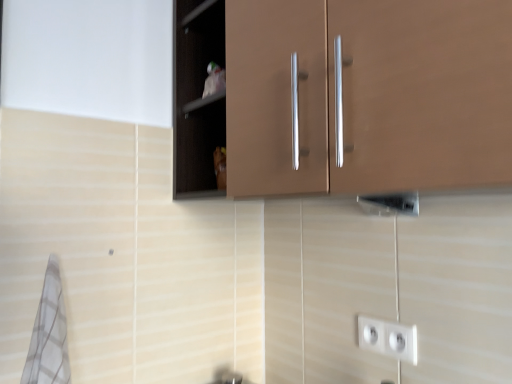
The width and height of the screenshot is (512, 384). I want to click on white plastic socket at lower right, so click(x=388, y=338).

Measure the distance between point (56, 302) and camera.

A distance of 93.80 centimeters exists between point (56, 302) and camera.

What do you see at coordinates (343, 95) in the screenshot? The height and width of the screenshot is (384, 512). I see `matte brown cabinet at upper center, arranged as the second cabinetry when viewed from the back` at bounding box center [343, 95].

Locate an element on the screen. The image size is (512, 384). white plastic socket at lower right is located at coordinates (388, 338).

Is matte brown cabinet at upper center, arranged as the second cabinetry when viewed from the back, positioned in front of white plastic socket at lower right?

Yes, matte brown cabinet at upper center, arranged as the second cabinetry when viewed from the back, is in front of white plastic socket at lower right.

In order to click on socket lying behind the matte brown cabinet at upper center, arranged as the second cabinetry when viewed from the back in this screenshot , I will do `click(388, 338)`.

From a real-world perspective, who is located lower, matte brown cabinet at upper center, the 1th cabinetry viewed from the front, or white plastic socket at lower right?

In real-world perspective, white plastic socket at lower right is lower.

From the image's perspective, does white checkered bath towel at lower left appear higher than matte brown cabinet at upper center, the 1th cabinetry viewed from the front?

No.

Is white checkered bath towel at lower left aimed at matte brown cabinet at upper center, arranged as the second cabinetry when viewed from the back?

No, white checkered bath towel at lower left does not turn towards matte brown cabinet at upper center, arranged as the second cabinetry when viewed from the back.

Can you confirm if white checkered bath towel at lower left is wider than matte brown cabinet at upper center, arranged as the second cabinetry when viewed from the back?

No.

From a real-world perspective, is white checkered bath towel at lower left positioned over matte brown cabinet at upper center, arranged as the second cabinetry when viewed from the back, based on gravity?

No, from a real-world perspective, white checkered bath towel at lower left is not over matte brown cabinet at upper center, arranged as the second cabinetry when viewed from the back

Considering the positions of points (349, 136) and (50, 342), is point (349, 136) farther from camera compared to point (50, 342)?

No.

Is matte brown cabinet at upper center, arranged as the second cabinetry when viewed from the back, bigger or smaller than white checkered bath towel at lower left?

In the image, matte brown cabinet at upper center, arranged as the second cabinetry when viewed from the back, appears to be larger than white checkered bath towel at lower left.

Is matte brown cabinet at upper center, arranged as the second cabinetry when viewed from the back, far from white checkered bath towel at lower left?

matte brown cabinet at upper center, arranged as the second cabinetry when viewed from the back, is near white checkered bath towel at lower left, not far away.

From the image's perspective, who appears lower, matte brown cabinet at upper center, arranged as the second cabinetry when viewed from the back, or white checkered bath towel at lower left?

white checkered bath towel at lower left.

How different are the orientations of brown matte cabinet at center, which is the first cabinetry from back to front, and white plastic socket at lower right in degrees?

They differ by 0.000609 degrees in their facing directions.

From the image's perspective, does brown matte cabinet at center, the 2th cabinetry from the front, appear lower than white plastic socket at lower right?

Incorrect, from the image's perspective, brown matte cabinet at center, the 2th cabinetry from the front, is higher than white plastic socket at lower right.

From a real-world perspective, is brown matte cabinet at center, the 2th cabinetry from the front, on white plastic socket at lower right?

Yes, from a real-world perspective, brown matte cabinet at center, the 2th cabinetry from the front, is above white plastic socket at lower right.

Is point (51, 285) positioned before point (384, 341)?

That is True.

Is white checkered bath towel at lower left smaller than white plastic socket at lower right?

No.

From the image's perspective, does white checkered bath towel at lower left appear higher than white plastic socket at lower right?

Correct, white checkered bath towel at lower left appears higher than white plastic socket at lower right in the image.

Does white checkered bath towel at lower left have a greater width compared to white plastic socket at lower right?

Yes, white checkered bath towel at lower left is wider than white plastic socket at lower right.

Is white plastic socket at lower right with white checkered bath towel at lower left?

white plastic socket at lower right and white checkered bath towel at lower left are not in contact.

Looking at this image, considering the sizes of objects white plastic socket at lower right and white checkered bath towel at lower left in the image provided, who is bigger, white plastic socket at lower right or white checkered bath towel at lower left?

white checkered bath towel at lower left is bigger.

Could you measure the distance between white plastic socket at lower right and white checkered bath towel at lower left?

white plastic socket at lower right and white checkered bath towel at lower left are 27.95 inches apart from each other.

Between white plastic socket at lower right and white checkered bath towel at lower left, which one has smaller width?

Thinner between the two is white plastic socket at lower right.

This screenshot has width=512, height=384. I want to click on bath towel that is on the left side of brown matte cabinet at center, the 2th cabinetry from the front, so coord(49,334).

From a real-world perspective, is brown matte cabinet at center, the 2th cabinetry from the front, located higher than white checkered bath towel at lower left?

Yes, from a real-world perspective, brown matte cabinet at center, the 2th cabinetry from the front, is above white checkered bath towel at lower left.

Is the position of brown matte cabinet at center, which is the first cabinetry from back to front, less distant than that of white checkered bath towel at lower left?

No, it is not.

Is brown matte cabinet at center, the 2th cabinetry from the front, positioned with its back to white checkered bath towel at lower left?

brown matte cabinet at center, the 2th cabinetry from the front, does not have its back to white checkered bath towel at lower left.

This screenshot has width=512, height=384. Identify the location of socket below the matte brown cabinet at upper center, arranged as the second cabinetry when viewed from the back (from the image's perspective). [x=388, y=338].

Locate an element on the screen. This screenshot has height=384, width=512. the 1st cabinetry above the white checkered bath towel at lower left (from the image's perspective) is located at coordinates (343, 95).

Looking at the image, which one is located closer to white checkered bath towel at lower left, matte brown cabinet at upper center, the 1th cabinetry viewed from the front, or white plastic socket at lower right?

matte brown cabinet at upper center, the 1th cabinetry viewed from the front, is positioned closer to the anchor white checkered bath towel at lower left.

Which object lies nearer to the anchor point brown matte cabinet at center, which is the first cabinetry from back to front, matte brown cabinet at upper center, arranged as the second cabinetry when viewed from the back, or white plastic socket at lower right?

matte brown cabinet at upper center, arranged as the second cabinetry when viewed from the back, is positioned closer to the anchor brown matte cabinet at center, which is the first cabinetry from back to front.

Considering their positions, is white plastic socket at lower right positioned further to white checkered bath towel at lower left than matte brown cabinet at upper center, the 1th cabinetry viewed from the front?

The object further to white checkered bath towel at lower left is white plastic socket at lower right.

Considering their positions, is white checkered bath towel at lower left positioned further to brown matte cabinet at center, the 2th cabinetry from the front, than white plastic socket at lower right?

Among the two, white checkered bath towel at lower left is located further to brown matte cabinet at center, the 2th cabinetry from the front.

Looking at the image, which one is located closer to white plastic socket at lower right, white checkered bath towel at lower left or matte brown cabinet at upper center, arranged as the second cabinetry when viewed from the back?

matte brown cabinet at upper center, arranged as the second cabinetry when viewed from the back, is closer to white plastic socket at lower right.

Which object lies further to the anchor point brown matte cabinet at center, which is the first cabinetry from back to front, white plastic socket at lower right or white checkered bath towel at lower left?

white checkered bath towel at lower left is positioned further to the anchor brown matte cabinet at center, which is the first cabinetry from back to front.

Considering their positions, is brown matte cabinet at center, which is the first cabinetry from back to front, positioned further to white checkered bath towel at lower left than white plastic socket at lower right?

white plastic socket at lower right is positioned further to the anchor white checkered bath towel at lower left.

Looking at the image, which one is located closer to white checkered bath towel at lower left, white plastic socket at lower right or brown matte cabinet at center, which is the first cabinetry from back to front?

brown matte cabinet at center, which is the first cabinetry from back to front.

Find the location of a particular element. cabinetry situated between white checkered bath towel at lower left and matte brown cabinet at upper center, arranged as the second cabinetry when viewed from the back, from left to right is located at coordinates (276, 97).

You are a GUI agent. You are given a task and a screenshot of the screen. Output one action in this format:
    pyautogui.click(x=<x>, y=<y>)
    Task: Click on the cabinetry between brown matte cabinet at center, which is the first cabinetry from back to front, and white plastic socket at lower right vertically
    Image resolution: width=512 pixels, height=384 pixels.
    Given the screenshot: What is the action you would take?
    pyautogui.click(x=343, y=95)